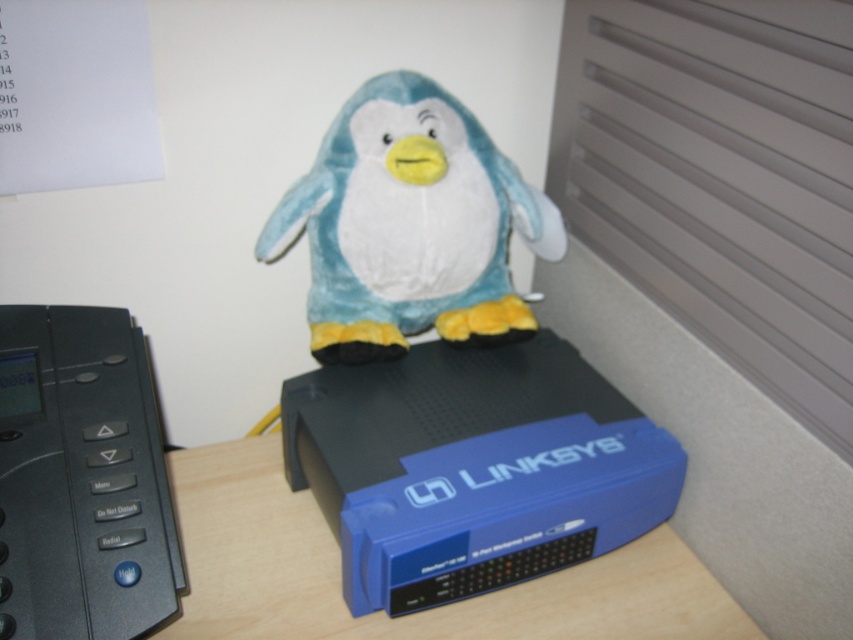
Can you confirm if soft plush penguin at center is wider than black plastic phone at left?

Correct, the width of soft plush penguin at center exceeds that of black plastic phone at left.

Is point (503, 198) closer to camera compared to point (161, 508)?

No.

Locate an element on the screen. The image size is (853, 640). soft plush penguin at center is located at coordinates (410, 225).

Is soft plush penguin at center further to the viewer compared to blue plastic router at center?

Yes, it is.

Between soft plush penguin at center and blue plastic router at center, which one is positioned lower?

blue plastic router at center is lower down.

Between point (357, 256) and point (523, 600), which one is positioned in front?

Point (523, 600) is more forward.

Locate an element on the screen. The image size is (853, 640). soft plush penguin at center is located at coordinates (410, 225).

Is black plastic phone at left shorter than blue plastic router at center?

No, black plastic phone at left is not shorter than blue plastic router at center.

Between point (51, 529) and point (605, 600), which one is positioned in front?

Point (51, 529)

Does point (13, 625) come farther from viewer compared to point (225, 609)?

No.

The image size is (853, 640). I want to click on black plastic phone at left, so click(80, 480).